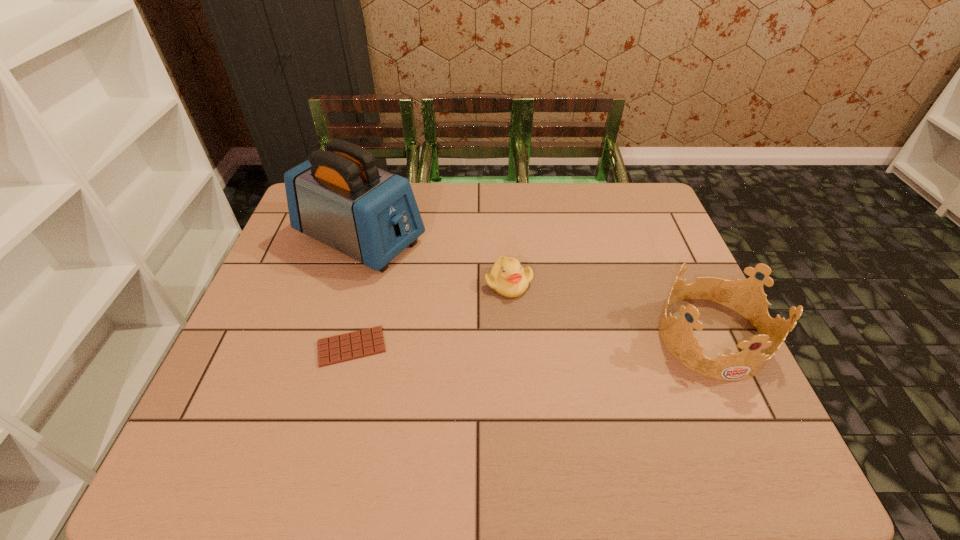
At what (x,y) coordinates should I click in order to perform the action: click on free space on the desktop that is between the shortest object and the rightmost object and is positioned on the front-facing side of the tallest object. Please return your answer as a coordinate pair (x, y). Image resolution: width=960 pixels, height=540 pixels. Looking at the image, I should click on (571, 340).

Identify the location of free space on the desktop that is between the shortest object and the tiara and is positioned at the face of the third tallest object. Image resolution: width=960 pixels, height=540 pixels. (564, 340).